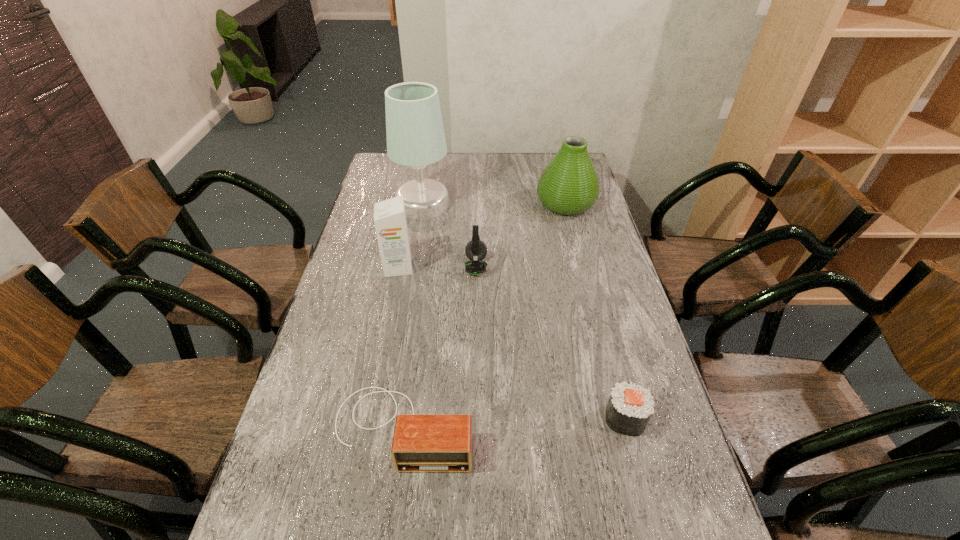
Identify the location of lampshade. (415, 135).

Where is `vase`? The height and width of the screenshot is (540, 960). vase is located at coordinates (569, 185).

Image resolution: width=960 pixels, height=540 pixels. Find the location of `carton`. carton is located at coordinates (390, 221).

I want to click on headset, so click(x=476, y=250).

The image size is (960, 540). Identify the location of radio receiver. 421,443.

Where is `sushi`? This screenshot has height=540, width=960. sushi is located at coordinates (630, 406).

Find the location of a particular element. This screenshot has width=960, height=540. free space located on the base of the lampshade is located at coordinates (521, 205).

This screenshot has width=960, height=540. I want to click on free spot located on the front of the vase, so click(576, 243).

The image size is (960, 540). In order to click on vacant position located 0.130m on the left of the carton in this screenshot , I will do `click(344, 267)`.

At what (x,y) coordinates should I click in order to perform the action: click on vacant space located 0.060m on the ear cups of the third shortest object. Please return your answer as a coordinate pair (x, y). The height and width of the screenshot is (540, 960). Looking at the image, I should click on (505, 267).